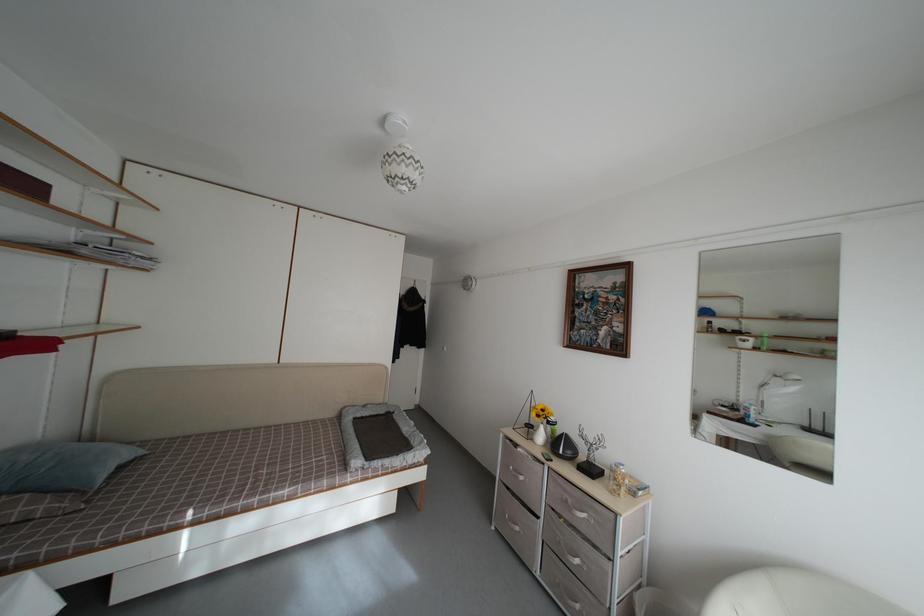
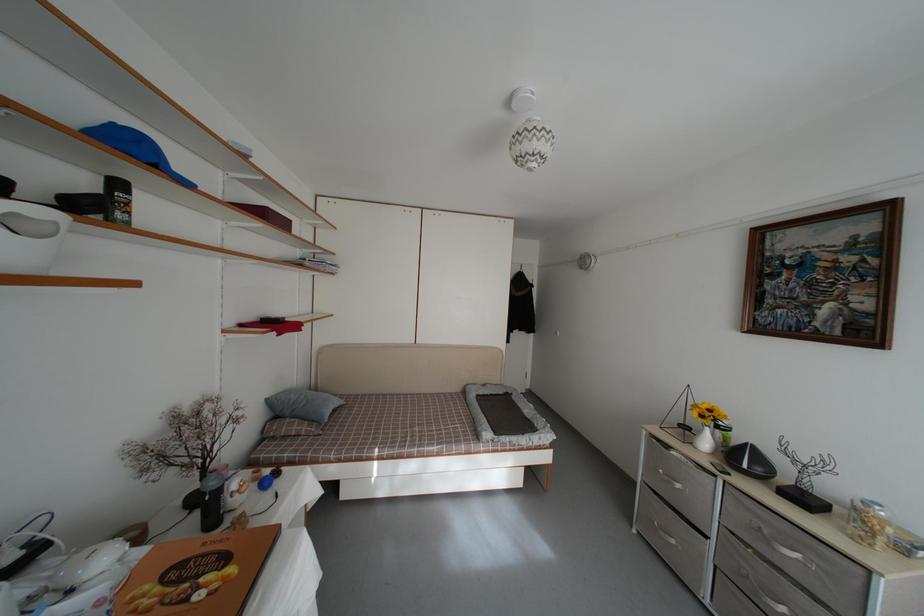
Where in the second image is the point corresponding to [103,499] from the first image?

(332, 431)